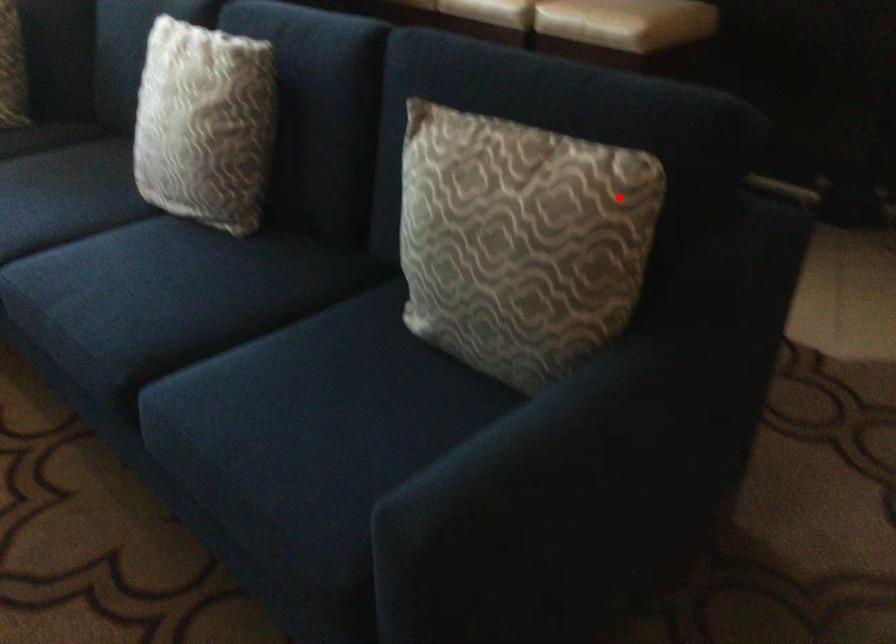
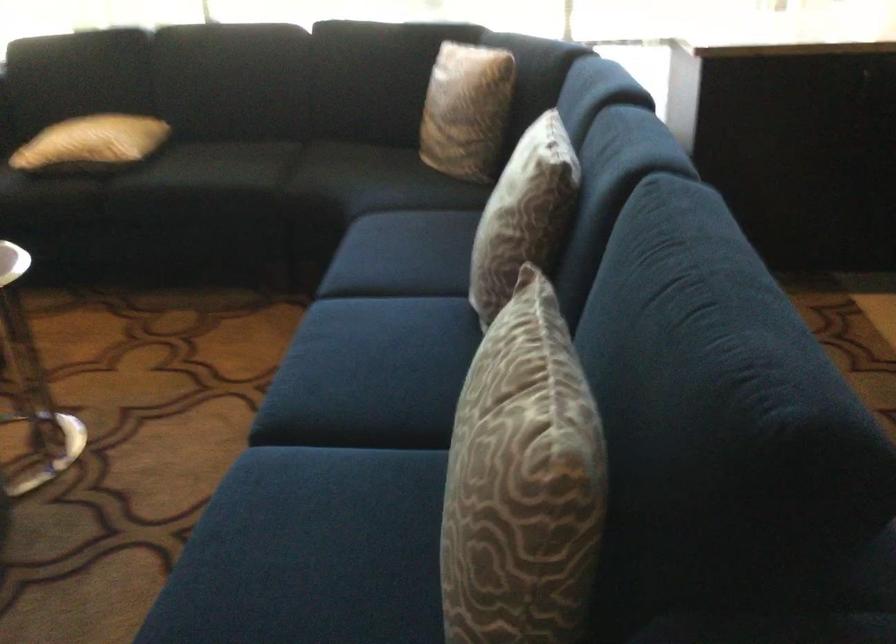
Find the pixel in the second image that matches the highlighted location in the first image.

(522, 482)